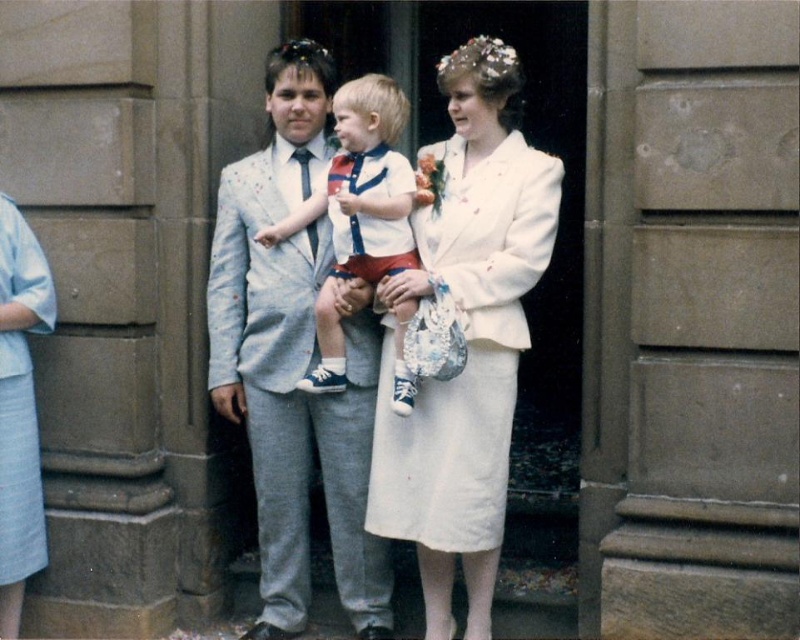
Question: Which point is farther to the camera?

Choices:
 (A) (376, 202)
 (B) (306, 451)
 (C) (478, 452)
 (D) (42, 525)

Answer: (B)

Question: Which point is closer to the camera?

Choices:
 (A) white satin dress at center
 (B) light gray suit at center
 (C) matte white shirt at center

Answer: (C)

Question: Is light gray suit at center to the left of matte white shirt at center from the viewer's perspective?

Choices:
 (A) yes
 (B) no

Answer: (A)

Question: Is light gray suit at center smaller than white satin dress at center?

Choices:
 (A) no
 (B) yes

Answer: (A)

Question: Can you confirm if light gray suit at center is positioned below matte white shirt at center?

Choices:
 (A) yes
 (B) no

Answer: (A)

Question: Considering the real-world distances, which object is closest to the white satin dress at center?

Choices:
 (A) light gray suit at center
 (B) matte white shirt at center
 (C) light blue fabric dress at left

Answer: (B)